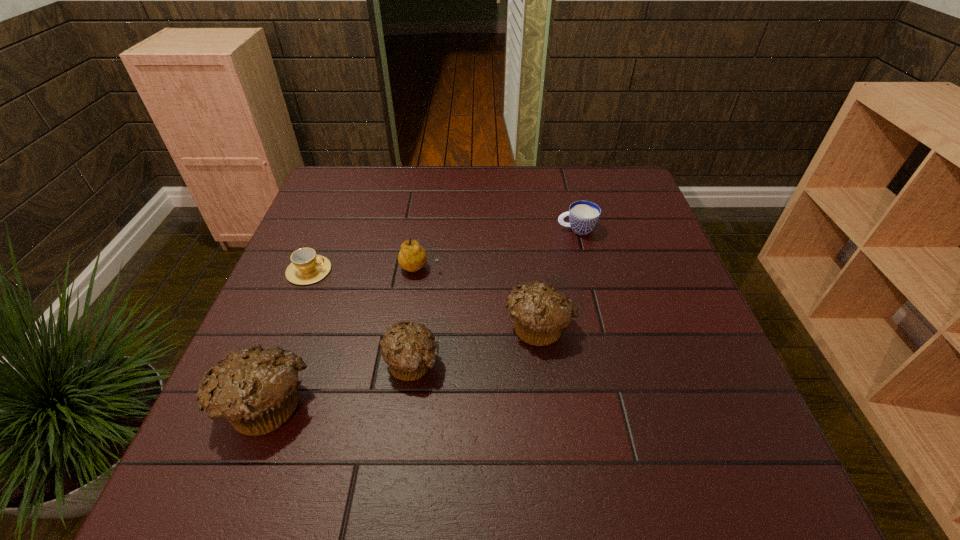
Please point a spot on the right to add another muffin. Please provide its 2D coordinates. Your answer should be formatted as a tuple, i.e. [(x, y)], where the tuple contains the x and y coordinates of a point satisfying the conditions above.

[(648, 293)]